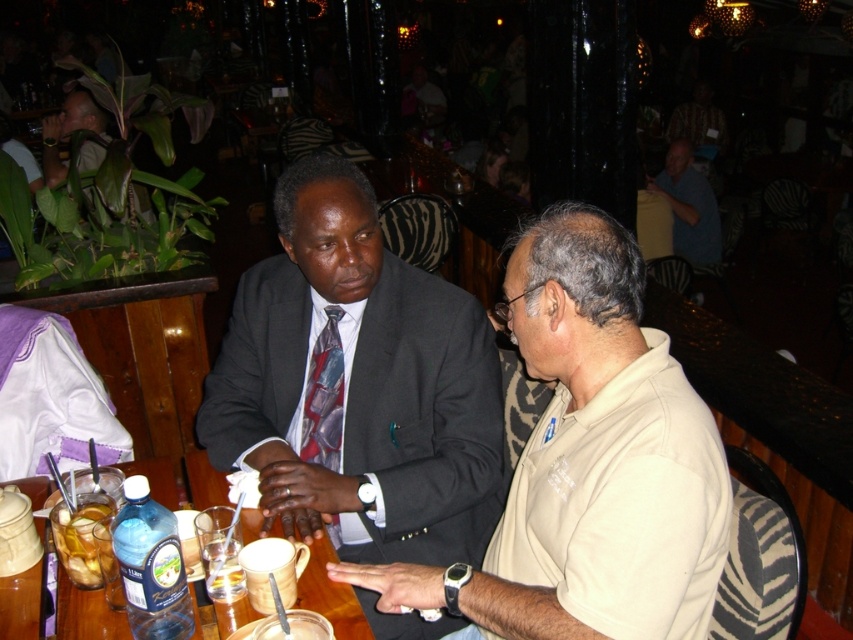
Is matte black suit at left below translucent glass cup at lower left?

No.

Which of these two, matte black suit at left or translucent glass cup at lower left, stands taller?

matte black suit at left is taller.

Is point (51, 161) closer to viewer compared to point (82, 534)?

No, (51, 161) is behind (82, 534).

Where is `matte black suit at left`? This screenshot has width=853, height=640. matte black suit at left is located at coordinates (68, 131).

At what (x,y) coordinates should I click in order to perform the action: click on shiny silk tie at center. Please return your answer as a coordinate pair (x, y). This screenshot has height=640, width=853. Looking at the image, I should click on (323, 396).

Which is behind, point (335, 422) or point (231, 600)?

The point (335, 422) is behind.

Where is `shiny silk tie at center`? shiny silk tie at center is located at coordinates (323, 396).

Does beige cotton shirt at center appear under matte black suit at left?

Indeed, beige cotton shirt at center is positioned under matte black suit at left.

The width and height of the screenshot is (853, 640). I want to click on beige cotton shirt at center, so click(x=590, y=461).

Which is behind, point (345, 573) or point (62, 138)?

Positioned behind is point (62, 138).

Identify the location of beige cotton shirt at center. The image size is (853, 640). (590, 461).